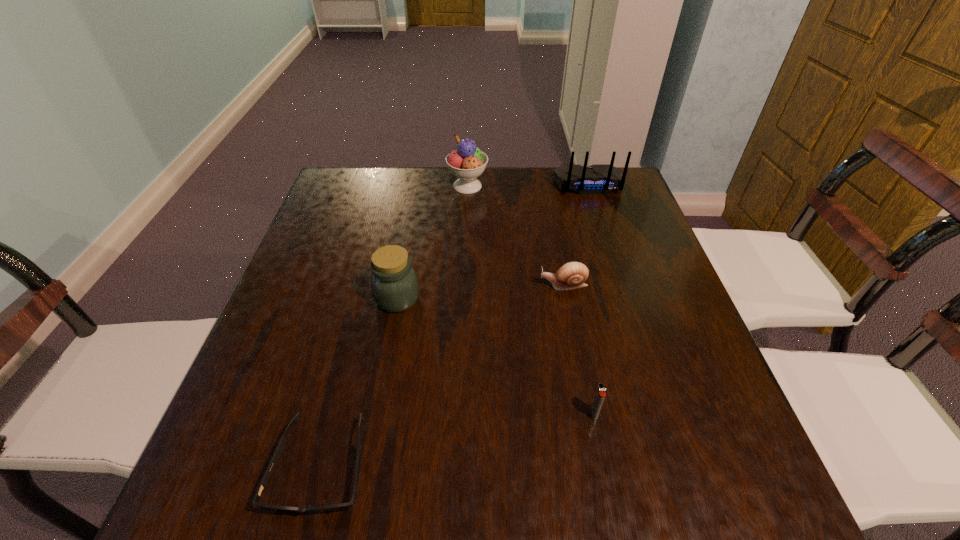
At what (x,y) coordinates should I click in order to perform the action: click on the third object from left to right. Please return your answer as a coordinate pair (x, y). The width and height of the screenshot is (960, 540). Looking at the image, I should click on (468, 162).

What are the coordinates of `router` in the screenshot? It's located at (597, 179).

At what (x,y) coordinates should I click in order to perform the action: click on jar. Please return your answer as a coordinate pair (x, y). This screenshot has width=960, height=540. Looking at the image, I should click on (394, 283).

Where is `the third shortest object`? Image resolution: width=960 pixels, height=540 pixels. the third shortest object is located at coordinates (600, 394).

I want to click on igniter, so click(600, 394).

Identify the location of escargot. The image size is (960, 540). (572, 275).

This screenshot has height=540, width=960. What are the coordinates of `the nearest object` in the screenshot? It's located at (x=279, y=449).

I want to click on sunglasses, so click(x=279, y=449).

Find the location of a particular element. free point located 0.110m on the right of the fourth object from right to left is located at coordinates (524, 186).

Image resolution: width=960 pixels, height=540 pixels. Identify the location of vacant position located on the back of the router. (606, 235).